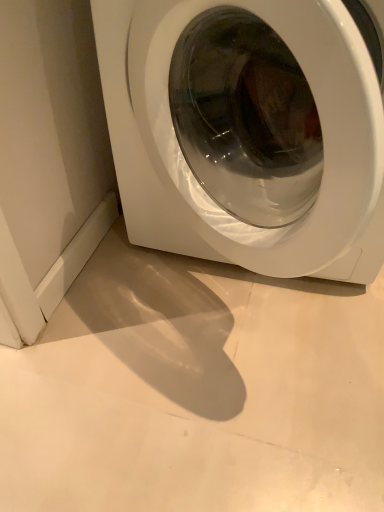
What is the approximate height of white glossy washing machine at center?

white glossy washing machine at center is 26.46 inches tall.

Measure the distance between white glossy washing machine at center and camera.

The distance of white glossy washing machine at center from camera is 16.13 inches.

The height and width of the screenshot is (512, 384). What are the coordinates of `white glossy washing machine at center` in the screenshot? It's located at (191, 172).

Describe the element at coordinates (191, 172) in the screenshot. I see `white glossy washing machine at center` at that location.

I want to click on white glossy washing machine at center, so click(191, 172).